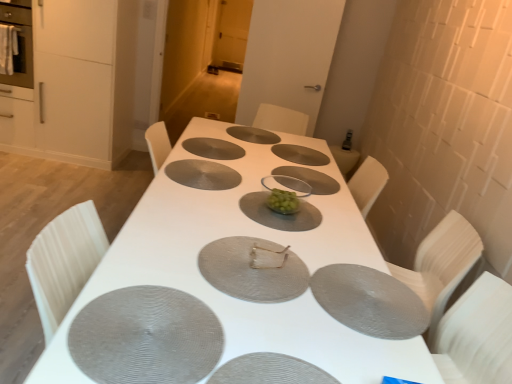
Locate an element on the screen. blank space to the left of metallic silver napkin at center is located at coordinates (190, 240).